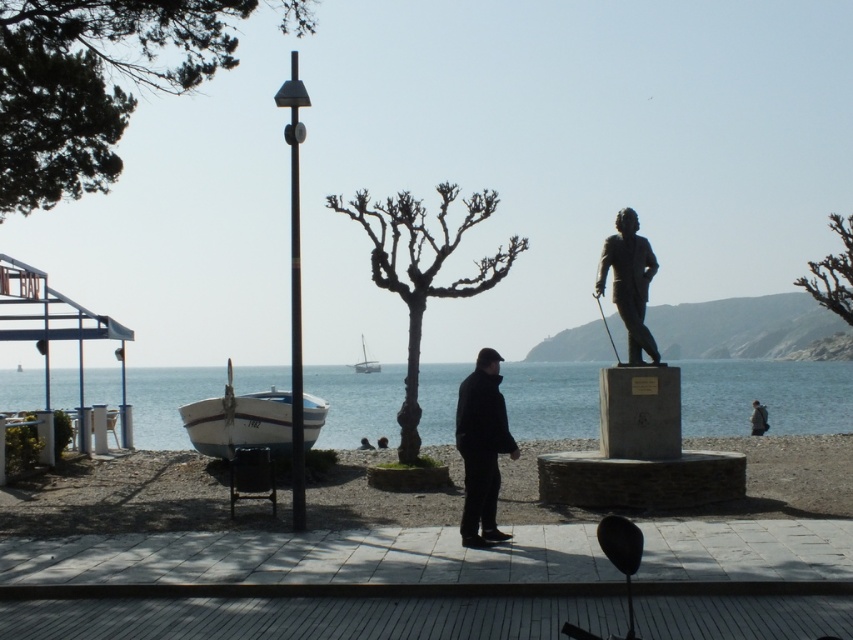
You are a painter setting up your easel to capture this coastal scene. You want to ensure that the bare branches at upper right and the white plastic boat at center are both visible in your painting. Based on their sizes in the image, which object should you depict as larger?

The bare branches at upper right should be depicted as larger since they have a greater height compared to the white plastic boat at center.

You are a bird looking for a place to land. You see the bare branches at upper right and the white plastic boat at center. Which one is above the other?

The bare branches at upper right is positioned over the white plastic boat at center, so it is above the boat.